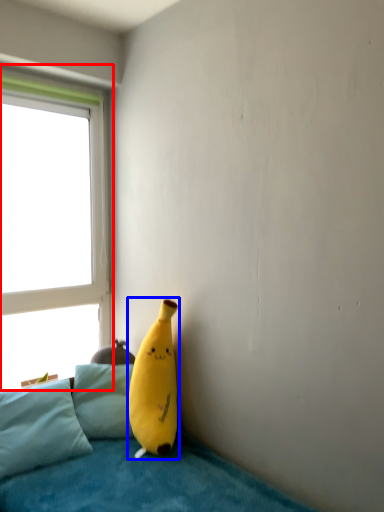
Question: Which object is closer to the camera taking this photo, window (highlighted by a red box) or banana (highlighted by a blue box)?

Choices:
 (A) window
 (B) banana

Answer: (B)